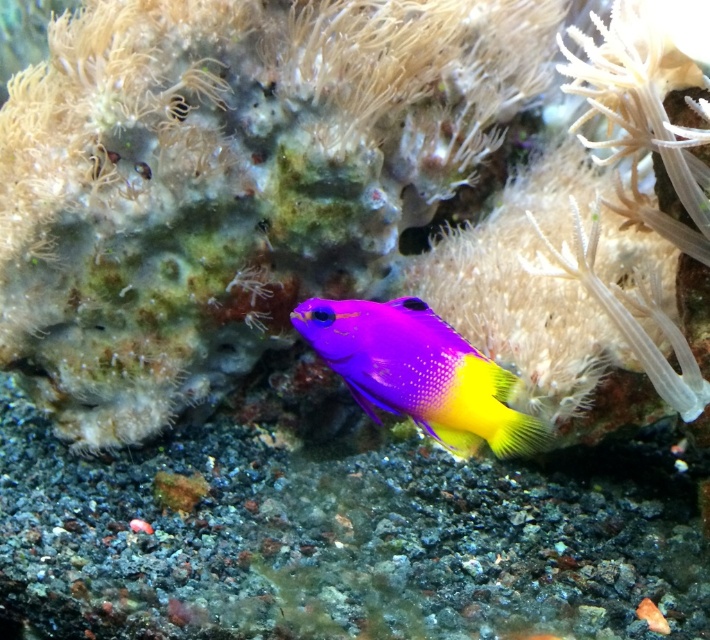
You are a marine biologist observing this underwater scene. You notice the purple glossy fish at center and the translucent white anemone at upper right. Which object is larger in size?

The purple glossy fish at center is smaller than the translucent white anemone at upper right, so the translucent white anemone at upper right is larger in size.

You are a marine biologist observing the underwater scene. You need to determine the relative sizes of the purple glossy fish at center and the translucent white anemone at upper right. Which object is wider?

The purple glossy fish at center is wider than the translucent white anemone at upper right.